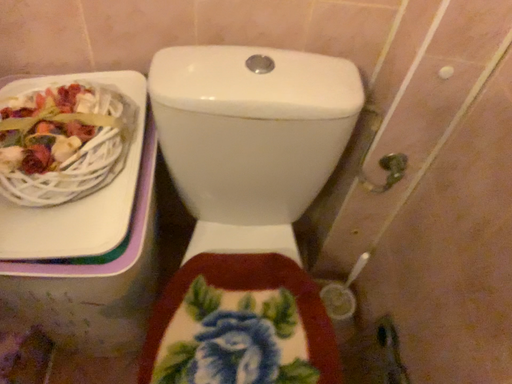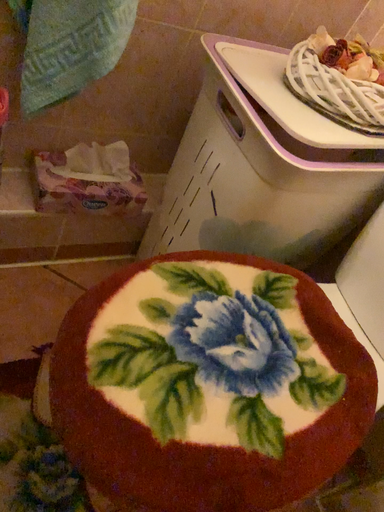
Question: Which way did the camera rotate in the video?

Choices:
 (A) rotated right
 (B) rotated left

Answer: (B)